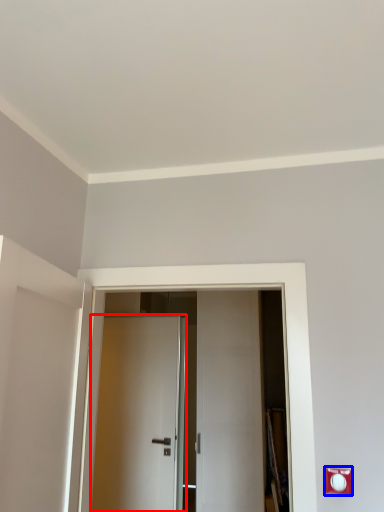
Question: Among these objects, which one is farthest to the camera, door (highlighted by a red box) or electric outlet (highlighted by a blue box)?

Choices:
 (A) door
 (B) electric outlet

Answer: (A)